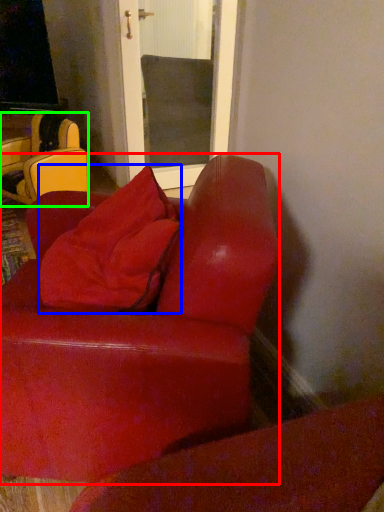
Question: Which object is the closest to the studio couch (highlighted by a red box)? Choose among these: throw pillow (highlighted by a blue box) or chair (highlighted by a green box).

Choices:
 (A) throw pillow
 (B) chair

Answer: (A)